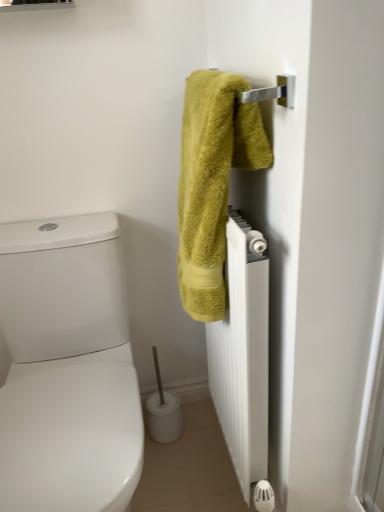
Question: Is white matte radiator at right completely or partially outside of green fuzzy towel at upper right?

Choices:
 (A) no
 (B) yes

Answer: (B)

Question: Considering the relative sizes of white matte radiator at right and green fuzzy towel at upper right in the image provided, is white matte radiator at right taller than green fuzzy towel at upper right?

Choices:
 (A) no
 (B) yes

Answer: (B)

Question: Is white matte radiator at right positioned with its back to green fuzzy towel at upper right?

Choices:
 (A) yes
 (B) no

Answer: (B)

Question: Is white matte radiator at right behind green fuzzy towel at upper right?

Choices:
 (A) yes
 (B) no

Answer: (A)

Question: Is white matte radiator at right smaller than green fuzzy towel at upper right?

Choices:
 (A) no
 (B) yes

Answer: (A)

Question: Would you say white matte radiator at right is a long distance from green fuzzy towel at upper right?

Choices:
 (A) no
 (B) yes

Answer: (A)

Question: From the image's perspective, does green fuzzy towel at upper right appear lower than white matte radiator at right?

Choices:
 (A) no
 (B) yes

Answer: (A)

Question: Is green fuzzy towel at upper right oriented away from white matte radiator at right?

Choices:
 (A) yes
 (B) no

Answer: (B)

Question: From the image's perspective, is green fuzzy towel at upper right above white matte radiator at right?

Choices:
 (A) yes
 (B) no

Answer: (A)

Question: From a real-world perspective, does green fuzzy towel at upper right sit lower than white matte radiator at right?

Choices:
 (A) yes
 (B) no

Answer: (B)

Question: Could you tell me if green fuzzy towel at upper right is facing white matte radiator at right?

Choices:
 (A) yes
 (B) no

Answer: (B)

Question: Does green fuzzy towel at upper right appear on the left side of white matte radiator at right?

Choices:
 (A) yes
 (B) no

Answer: (A)

Question: Is green fuzzy towel at upper right in front of or behind white matte radiator at right in the image?

Choices:
 (A) behind
 (B) front

Answer: (B)